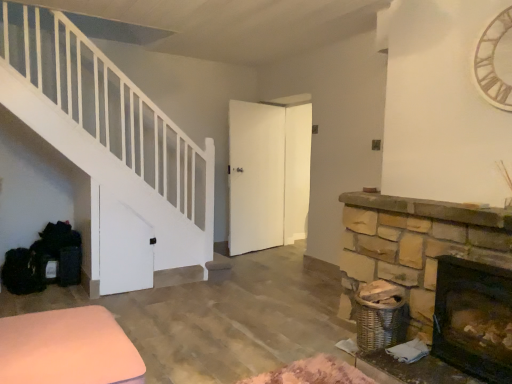
Question: Can you confirm if wooden clock at upper right is smaller than pink fabric ottoman at lower left?

Choices:
 (A) no
 (B) yes

Answer: (B)

Question: Is wooden clock at upper right far from pink fabric ottoman at lower left?

Choices:
 (A) no
 (B) yes

Answer: (B)

Question: Is wooden clock at upper right facing towards pink fabric ottoman at lower left?

Choices:
 (A) no
 (B) yes

Answer: (A)

Question: From the image's perspective, is wooden clock at upper right below pink fabric ottoman at lower left?

Choices:
 (A) no
 (B) yes

Answer: (A)

Question: Is wooden clock at upper right at the right side of pink fabric ottoman at lower left?

Choices:
 (A) no
 (B) yes

Answer: (B)

Question: Is wooden clock at upper right completely or partially outside of pink fabric ottoman at lower left?

Choices:
 (A) yes
 (B) no

Answer: (A)

Question: Can you confirm if wooden clock at upper right is shorter than dark brown stone fireplace at lower right?

Choices:
 (A) yes
 (B) no

Answer: (B)

Question: Considering the relative sizes of wooden clock at upper right and dark brown stone fireplace at lower right in the image provided, is wooden clock at upper right taller than dark brown stone fireplace at lower right?

Choices:
 (A) yes
 (B) no

Answer: (A)

Question: From the image's perspective, would you say wooden clock at upper right is shown under dark brown stone fireplace at lower right?

Choices:
 (A) yes
 (B) no

Answer: (B)

Question: From the image's perspective, would you say wooden clock at upper right is positioned over dark brown stone fireplace at lower right?

Choices:
 (A) no
 (B) yes

Answer: (B)

Question: Considering the relative positions of wooden clock at upper right and dark brown stone fireplace at lower right in the image provided, is wooden clock at upper right in front of dark brown stone fireplace at lower right?

Choices:
 (A) yes
 (B) no

Answer: (B)

Question: Does wooden clock at upper right have a smaller size compared to dark brown stone fireplace at lower right?

Choices:
 (A) no
 (B) yes

Answer: (B)

Question: Does pink fabric ottoman at lower left contain wooden clock at upper right?

Choices:
 (A) no
 (B) yes

Answer: (A)